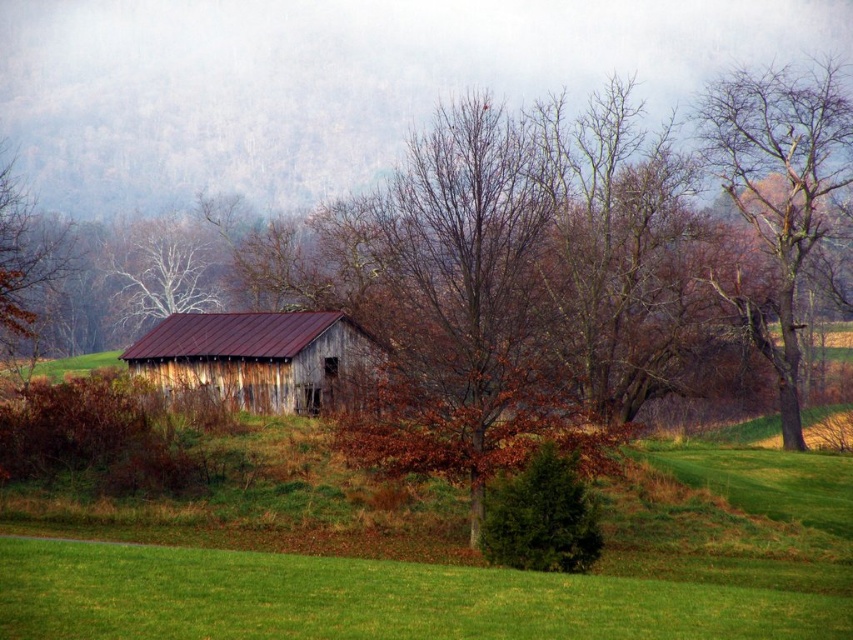
Looking at this image, you are standing at the center of the image and want to walk towards the point labeled as point (x=779, y=188). Which direction should you go to reach that point?

The point (x=779, y=188) corresponds to the bare wood tree at upper right, so you should walk towards the upper right direction to reach it.